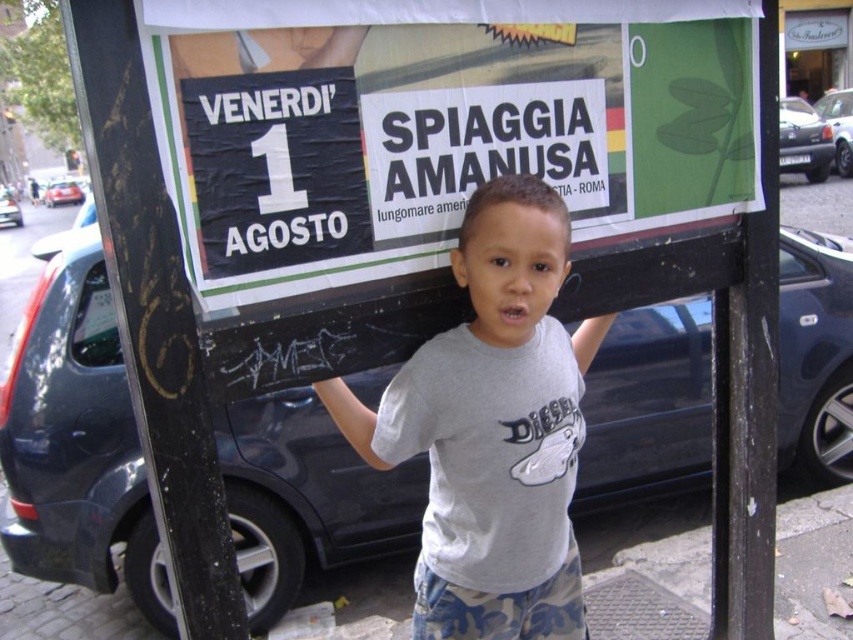
You are a photographer setting up for a shoot. You see the gray cotton shirt at center and the silver metallic sedan at right. Which object is positioned lower in the image?

The gray cotton shirt at center is located below the silver metallic sedan at right, so it is positioned lower in the image.